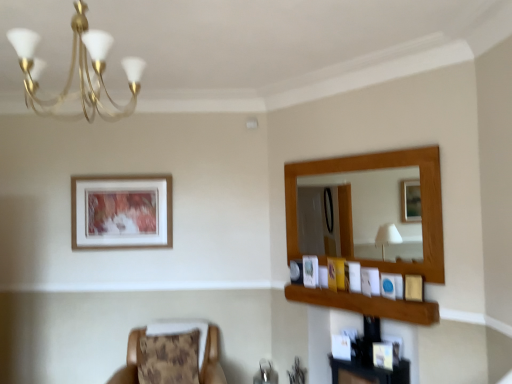
Question: Is there a large distance between wooden picture frame at upper right, placed as the 4th picture frame when sorted from front to back, and brown textured cushion at lower left?

Choices:
 (A) yes
 (B) no

Answer: (A)

Question: From the image's perspective, is wooden picture frame at upper right, which is counted as the third picture frame, starting from the left, located above brown textured cushion at lower left?

Choices:
 (A) yes
 (B) no

Answer: (A)

Question: Is the position of wooden picture frame at upper right, placed as the 4th picture frame when sorted from front to back, less distant than that of brown textured cushion at lower left?

Choices:
 (A) no
 (B) yes

Answer: (A)

Question: Is brown textured cushion at lower left surrounded by wooden picture frame at upper right, the 3th picture frame when ordered from back to front?

Choices:
 (A) yes
 (B) no

Answer: (B)

Question: Is wooden picture frame at upper right, the 3th picture frame when ordered from back to front, further to the viewer compared to brown textured cushion at lower left?

Choices:
 (A) no
 (B) yes

Answer: (B)

Question: Is wooden frame at upper right inside the boundaries of matte gold picture frame at right, marked as the 6th picture frame in a back-to-front arrangement, or outside?

Choices:
 (A) outside
 (B) inside

Answer: (A)

Question: Considering the positions of wooden frame at upper right and matte gold picture frame at right, arranged as the 1th picture frame when viewed from the front, in the image, is wooden frame at upper right taller or shorter than matte gold picture frame at right, arranged as the 1th picture frame when viewed from the front,?

Choices:
 (A) tall
 (B) short

Answer: (B)

Question: From the image's perspective, is wooden frame at upper right above or below matte gold picture frame at right, which is the 1th picture frame from right to left?

Choices:
 (A) above
 (B) below

Answer: (B)

Question: Considering their positions, is wooden frame at upper right located in front of or behind matte gold picture frame at right, the sixth picture frame viewed from the left?

Choices:
 (A) front
 (B) behind

Answer: (A)

Question: From a real-world perspective, relative to brown textured cushion at lower left, is gold metallic chandelier at upper left vertically above or below?

Choices:
 (A) below
 (B) above

Answer: (B)

Question: Considering the positions of gold metallic chandelier at upper left and brown textured cushion at lower left in the image, is gold metallic chandelier at upper left wider or thinner than brown textured cushion at lower left?

Choices:
 (A) thin
 (B) wide

Answer: (A)

Question: Looking at the image, does gold metallic chandelier at upper left seem bigger or smaller compared to brown textured cushion at lower left?

Choices:
 (A) small
 (B) big

Answer: (A)

Question: Considering the positions of gold metallic chandelier at upper left and brown textured cushion at lower left in the image, is gold metallic chandelier at upper left taller or shorter than brown textured cushion at lower left?

Choices:
 (A) tall
 (B) short

Answer: (A)

Question: From the image's perspective, is wooden picture frame at right, arranged as the 3th picture frame when viewed from the front, above or below brown textured cushion at lower left?

Choices:
 (A) above
 (B) below

Answer: (A)

Question: In the image, is wooden picture frame at right, marked as the fourth picture frame in a left-to-right arrangement, positioned in front of or behind brown textured cushion at lower left?

Choices:
 (A) behind
 (B) front

Answer: (A)